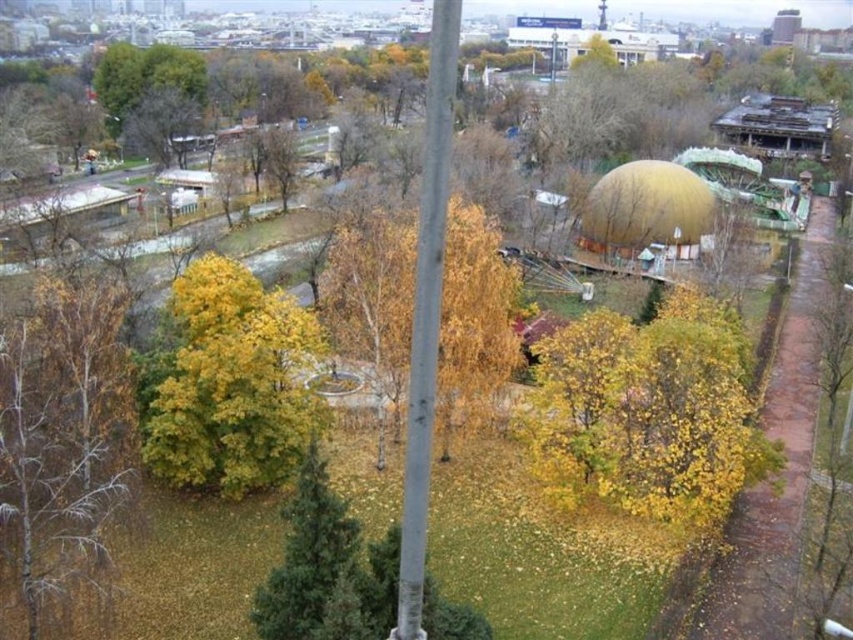
You are a park visitor standing at the base of the yellow leafy tree at center. Looking towards the yellow matte tree at lower right, which direction should you walk to reach it?

The yellow matte tree at lower right is below the yellow leafy tree at center, so you should walk downward to reach it.

You are a park visitor trying to find the best spot to take a photo of both the yellow matte tree at lower right and the yellow leafy tree at center. Considering their sizes, which tree should you position closer to the camera to include both in the frame without one overwhelming the other?

Result: Since the yellow matte tree at lower right occupies less space than the yellow leafy tree at center, you should position the yellow leafy tree at center closer to the camera to balance their sizes in the photo.